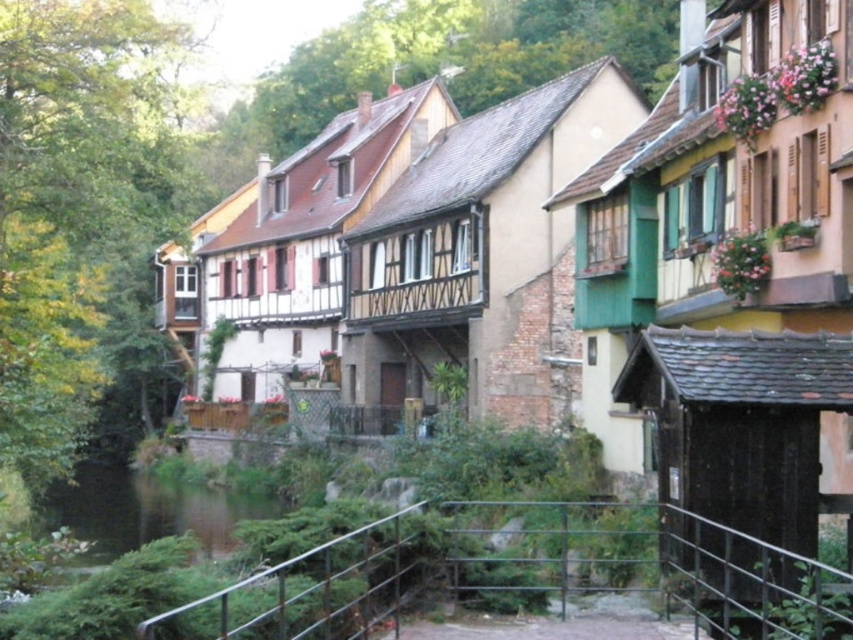
You are standing at the riverbank looking at the row of traditional half timbered houses. You notice two points marked on the image at coordinates point (380, 531) and point (252, 516). Which point is closer to you, the observer?

Point (380, 531) is in front of point (252, 516), so it is closer to you.